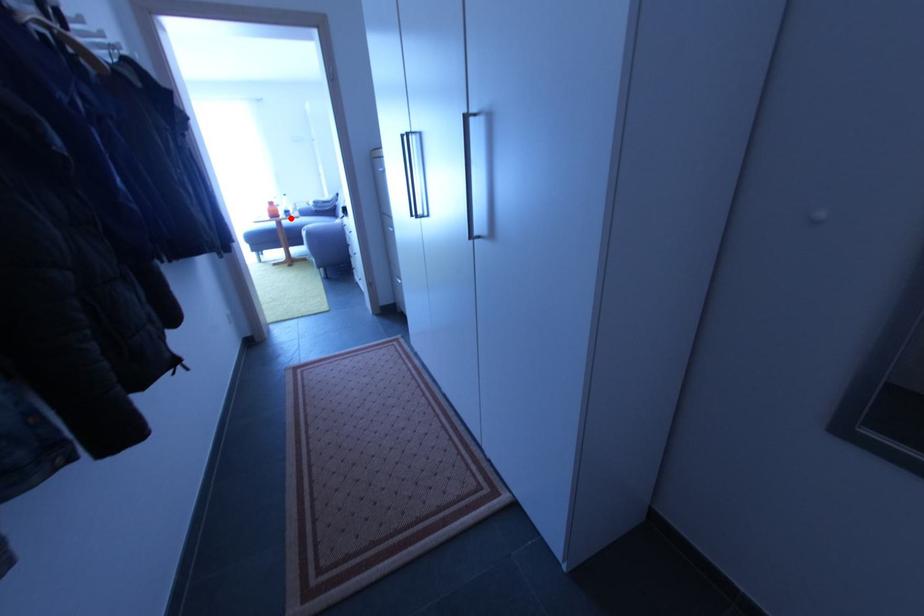
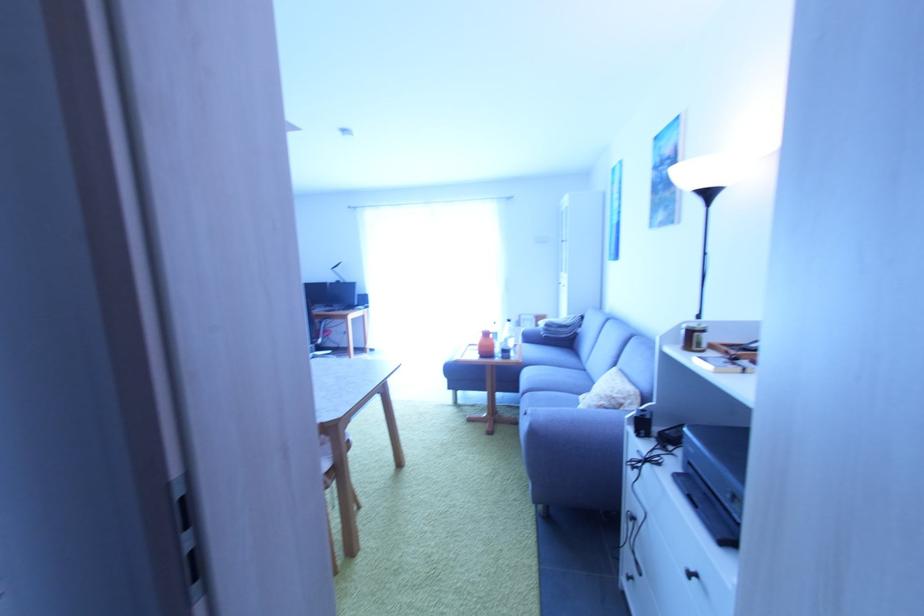
Find the pixel in the second image that matches the highlighted location in the first image.

(507, 360)